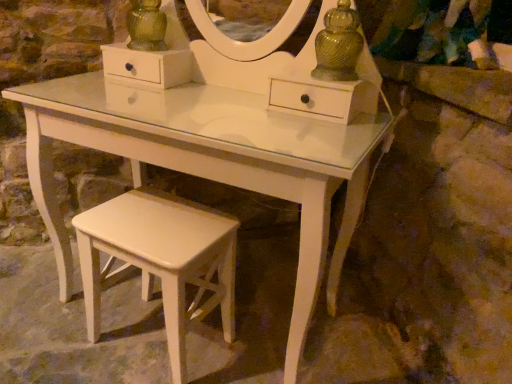
Where is `blank space to the left of white painted wood stool at lower left`? This screenshot has height=384, width=512. blank space to the left of white painted wood stool at lower left is located at coordinates (53, 354).